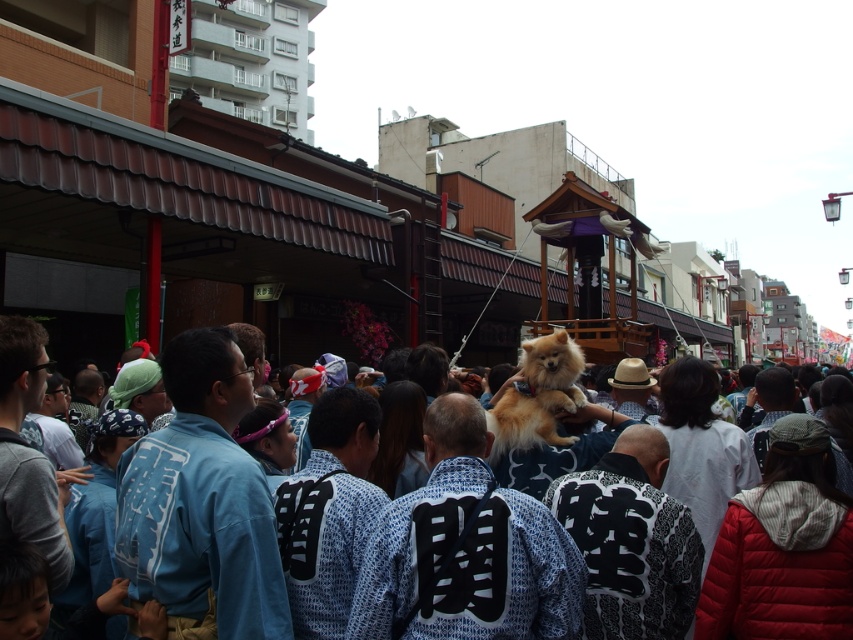
Does fluffy brown dog at center have a lesser height compared to golden fur dog at center?

In fact, fluffy brown dog at center may be taller than golden fur dog at center.

You are a GUI agent. You are given a task and a screenshot of the screen. Output one action in this format:
    pyautogui.click(x=<x>, y=<y>)
    Task: Click on the fluffy brown dog at center
    This screenshot has height=640, width=853.
    Given the screenshot: What is the action you would take?
    point(207,376)

Where is `fluffy brown dog at center`? The width and height of the screenshot is (853, 640). fluffy brown dog at center is located at coordinates (207, 376).